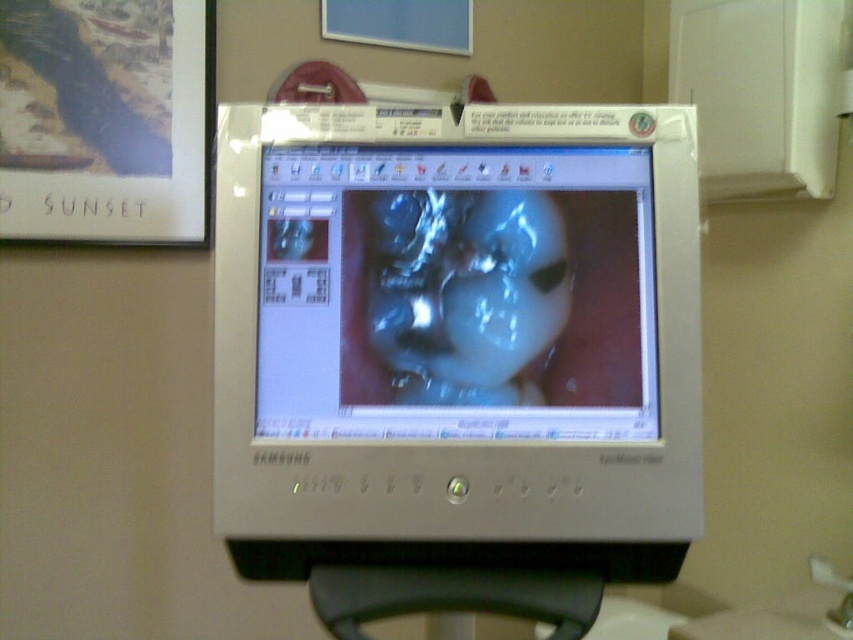
Which is more to the left, silver metallic monitor at center or translucent plastic face at center?

Positioned to the left is translucent plastic face at center.

I want to click on silver metallic monitor at center, so click(x=457, y=339).

Image resolution: width=853 pixels, height=640 pixels. Identify the location of silver metallic monitor at center. (457, 339).

In the scene shown: Which is more to the left, silver metallic monitor at center or shiny metallic monitor at center?

Positioned to the left is shiny metallic monitor at center.

From the picture: Who is more forward, (340, 456) or (546, 172)?

Point (340, 456)

This screenshot has height=640, width=853. Find the location of `silver metallic monitor at center`. silver metallic monitor at center is located at coordinates (457, 339).

Can you confirm if shiny metallic monitor at center is taller than translucent plastic face at center?

Indeed, shiny metallic monitor at center has a greater height compared to translucent plastic face at center.

Locate an element on the screen. The width and height of the screenshot is (853, 640). shiny metallic monitor at center is located at coordinates (456, 292).